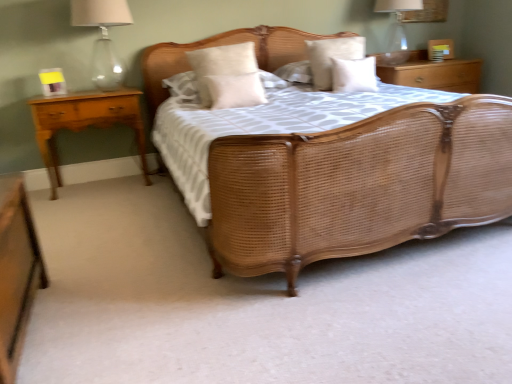
What are the coordinates of `vacant space in light brown wood nightstand at left, which is the second nightstand from front to back (from a real-world perspective)` in the screenshot? It's located at (102, 184).